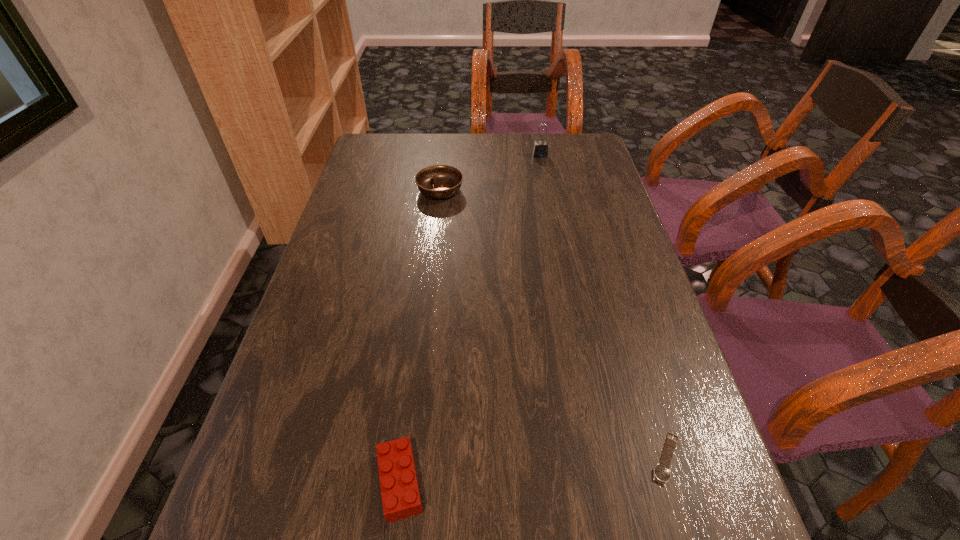
Locate an element on the screen. This screenshot has width=960, height=540. object present at the far edge is located at coordinates (540, 150).

At what (x,y) coordinates should I click in order to perform the action: click on object present at the right edge. Please return your answer as a coordinate pair (x, y). The height and width of the screenshot is (540, 960). Looking at the image, I should click on (661, 473).

I want to click on free point at the far edge, so click(x=541, y=170).

In order to click on free space at the left edge in this screenshot , I will do `click(289, 468)`.

Locate an element on the screen. This screenshot has height=540, width=960. vacant space at the right edge of the desktop is located at coordinates click(605, 180).

The image size is (960, 540). I want to click on free space between the rightmost object and the soup bowl, so click(553, 325).

I want to click on free space that is in between the third nearest object and the watch, so click(553, 325).

Locate an element on the screen. This screenshot has width=960, height=540. vacant space that is in between the second object from right to left and the third nearest object is located at coordinates (491, 173).

Identify the location of free spot between the third object from left to right and the Lego. (470, 319).

The height and width of the screenshot is (540, 960). Identify the location of free point between the watch and the soup bowl. (553, 325).